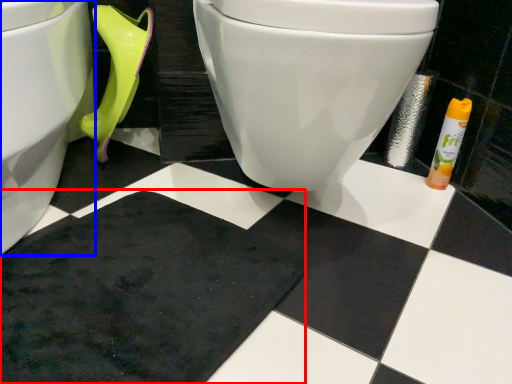
Question: Which of the following is the closest to the observer, bath mat (highlighted by a red box) or toilet (highlighted by a blue box)?

Choices:
 (A) bath mat
 (B) toilet

Answer: (B)